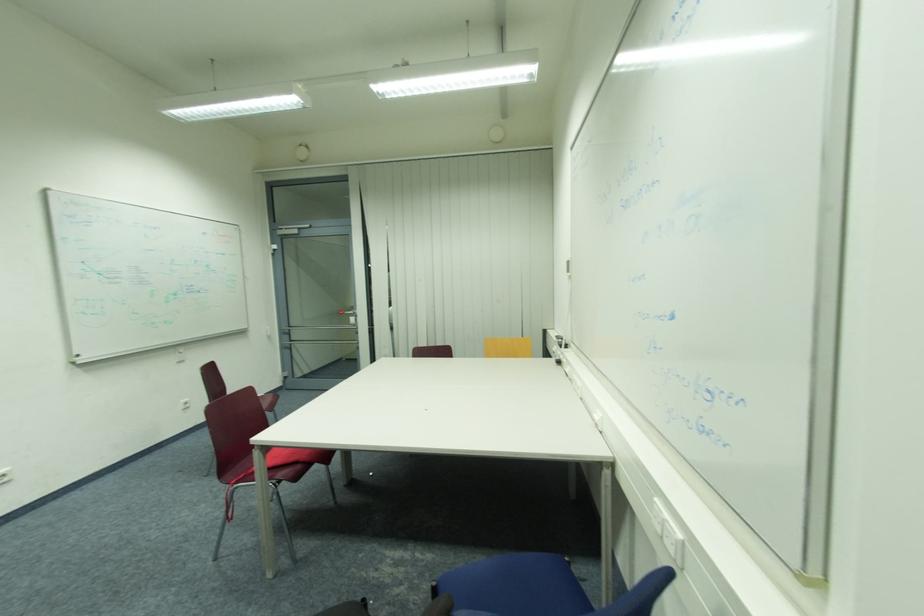
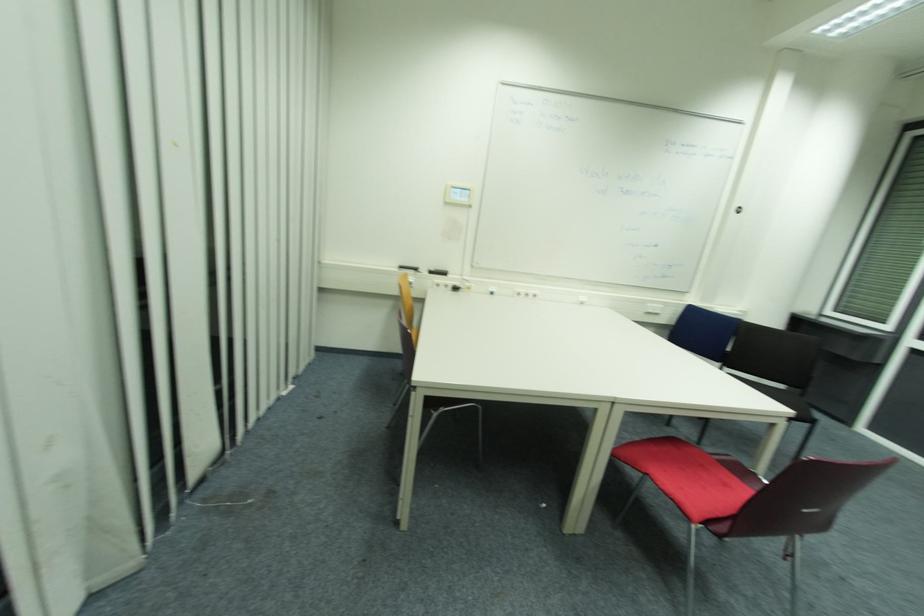
Question: I am providing you with two images of the same scene from different viewpoints. Which of the following objects are not visible in image2?

Choices:
 (A) red chair sitting surface
 (B) white power outlet
 (C) black whiteboard eraser
 (D) none of these

Answer: (D)